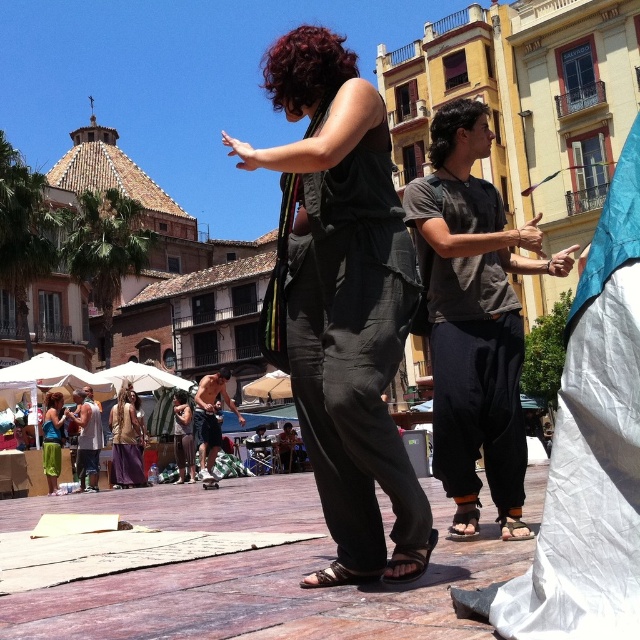
Question: Which of the following is the farthest from the observer?

Choices:
 (A) (497, 266)
 (B) (376, 401)
 (C) (54, 440)

Answer: (C)

Question: Is dark gray cotton shirt at center to the right of gold metallic mask at center from the viewer's perspective?

Choices:
 (A) no
 (B) yes

Answer: (B)

Question: Which point is closer to the camera taking this photo?

Choices:
 (A) (412, 547)
 (B) (432, 209)
 (C) (131, 481)

Answer: (A)

Question: Can you confirm if dark gray cotton shirt at center is bigger than shiny metallic shorts at center?

Choices:
 (A) yes
 (B) no

Answer: (A)

Question: Does shiny metallic shorts at center have a greater width compared to gray tank top at lower left?

Choices:
 (A) yes
 (B) no

Answer: (A)

Question: Among these points, which one is nearest to the camera?

Choices:
 (A) (380, 352)
 (B) (220, 440)
 (C) (61, 432)
 (D) (116, 412)

Answer: (A)